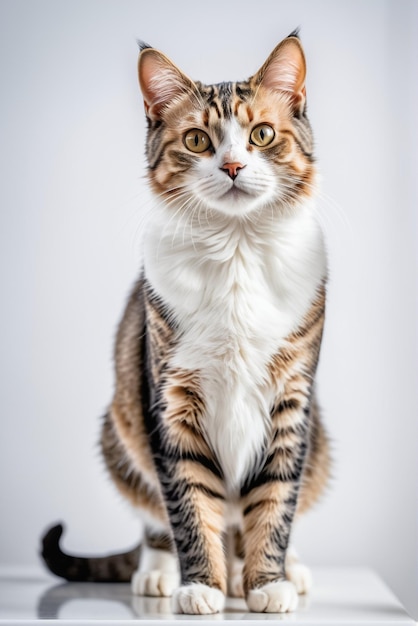
You are a GUI agent. You are given a task and a screenshot of the screen. Output one action in this format:
    pyautogui.click(x=<x>, y=<y>)
    Task: Click on the wall
    
    Given the screenshot: What is the action you would take?
    pyautogui.click(x=375, y=207)